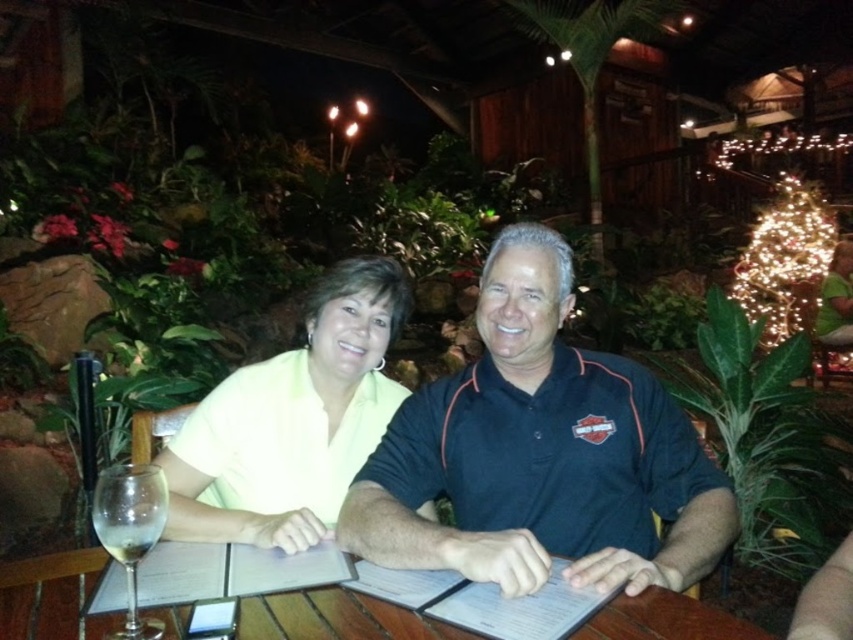
Question: Among these points, which one is nearest to the camera?

Choices:
 (A) (91, 577)
 (B) (604, 452)
 (C) (331, 285)
 (D) (161, 524)

Answer: (D)

Question: Based on their relative distances, which object is nearer to the dark blue polo shirt at center?

Choices:
 (A) wooden table at center
 (B) clear glass wine glass at lower left

Answer: (A)

Question: Does dark blue polo shirt at center have a greater width compared to wooden table at center?

Choices:
 (A) yes
 (B) no

Answer: (B)

Question: Where is yellow matte shirt at center located in relation to clear glass wine glass at lower left in the image?

Choices:
 (A) below
 (B) above

Answer: (B)

Question: Is dark blue polo shirt at center wider than wooden table at center?

Choices:
 (A) no
 (B) yes

Answer: (A)

Question: Which of the following is the farthest from the observer?

Choices:
 (A) wooden table at center
 (B) yellow matte shirt at center
 (C) clear glass wine glass at lower left
 (D) dark blue polo shirt at center

Answer: (B)